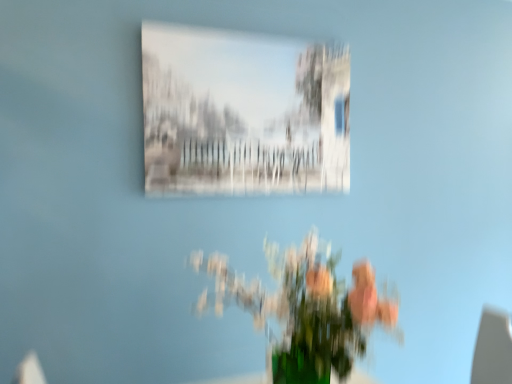
In order to click on green glossy houseplant at lower center in this screenshot , I will do `click(304, 310)`.

The height and width of the screenshot is (384, 512). What do you see at coordinates (304, 310) in the screenshot?
I see `green glossy houseplant at lower center` at bounding box center [304, 310].

The width and height of the screenshot is (512, 384). I want to click on green glossy houseplant at lower center, so click(x=304, y=310).